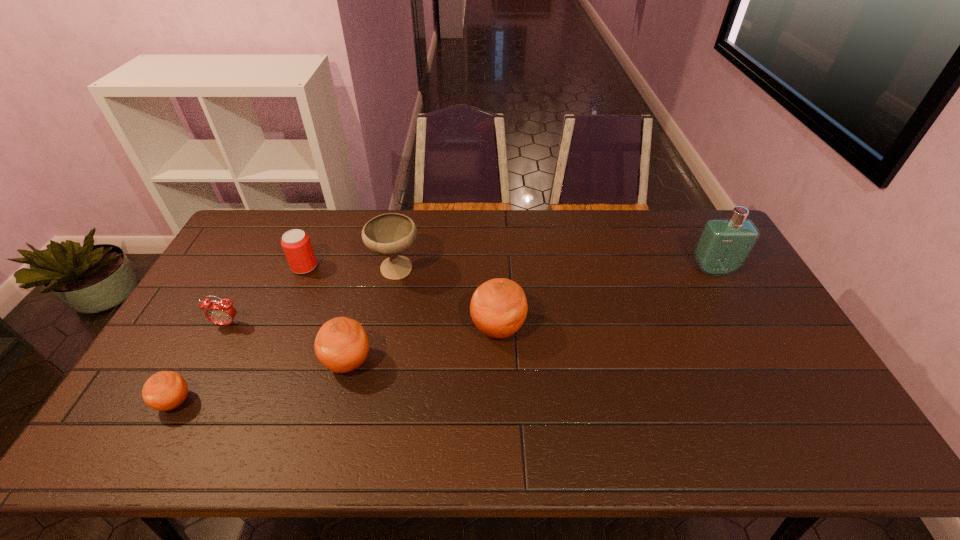
Identify the location of vacant area situated 0.370m on the right of the second orange from right to left. The image size is (960, 540). (509, 362).

Where is `vacant space situated on the right of the rightmost orange`? This screenshot has height=540, width=960. vacant space situated on the right of the rightmost orange is located at coordinates (611, 328).

You are a GUI agent. You are given a task and a screenshot of the screen. Output one action in this format:
    pyautogui.click(x=<x>, y=<y>)
    Task: Click on the vacant space located 0.190m on the right of the fifth object from right to left
    The image size is (960, 540).
    Given the screenshot: What is the action you would take?
    pyautogui.click(x=373, y=267)

Find the location of `vacant space situated 0.330m on the right of the chalice`. vacant space situated 0.330m on the right of the chalice is located at coordinates (520, 271).

You are a GUI agent. You are given a task and a screenshot of the screen. Output one action in this format:
    pyautogui.click(x=<x>, y=<y>)
    Task: Click on the vacant space positioned on the front label of the tallest object
    The height and width of the screenshot is (540, 960).
    Given the screenshot: What is the action you would take?
    pyautogui.click(x=750, y=336)

Identify the location of vacant point located 0.260m on the face of the alarm clock. coord(181,410).

Find the location of a particular element. This screenshot has width=960, height=540. orange that is positioned at the left edge is located at coordinates (166, 390).

The height and width of the screenshot is (540, 960). Identify the location of alarm clock located at the left edge. (222, 312).

This screenshot has width=960, height=540. I want to click on object at the right edge, so click(x=724, y=245).

Identify the location of object that is at the near left corner. (166, 390).